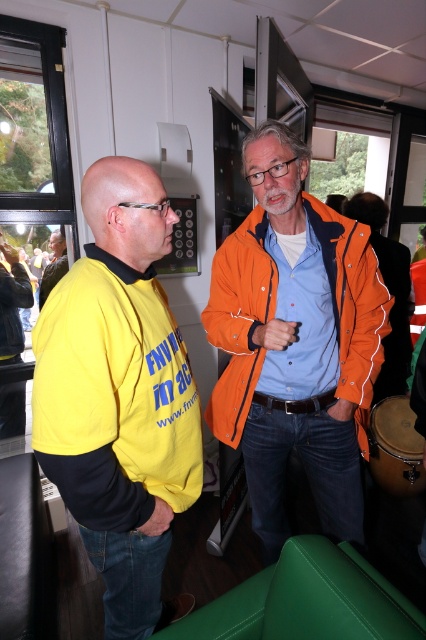
Looking at this image, what are the coordinates of the orange fabric jacket at center?

The orange fabric jacket at center is located at point (388, 291).